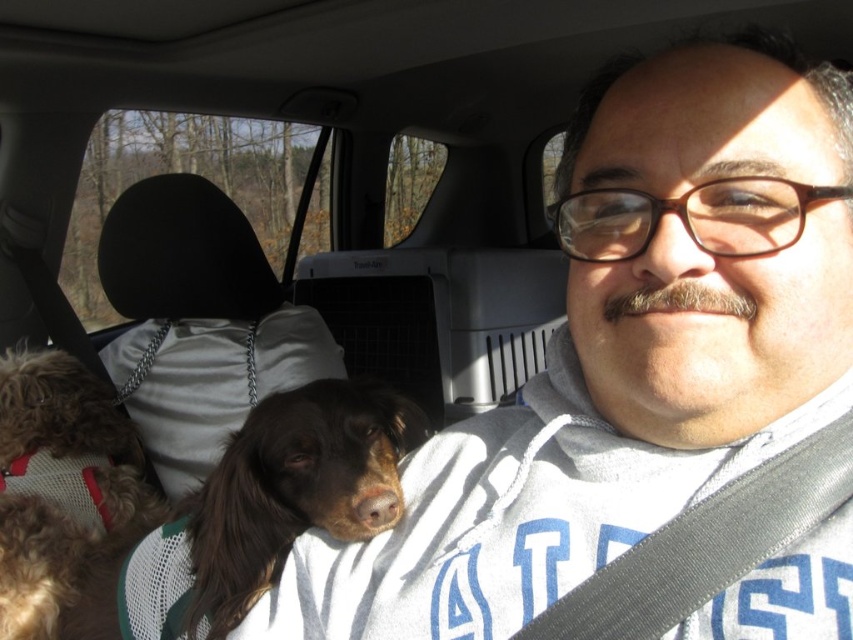
You are sitting in the driver seat of a car and want to reach a point that is 28.84 inches away from you. The point is located at coordinates point (393, 522). Can you safely reach that point without moving out of your seat?

The point (393, 522) is 28.84 inches from the viewer, so yes, you can safely reach it without moving out of your seat since it is within a typical arm reach distance.

You are a delivery person who needs to ensure the safety of the dogs in the car. The safety guidelines state that any dog within 30 inches of the viewer must be secured with a harness. Is the brown fur dog at center within the required distance?

The brown fur dog at center is 27.94 inches away from the viewer, which is within the 30 inch guideline. Therefore, the brown fur dog at center must be secured with a harness according to the safety guidelines.